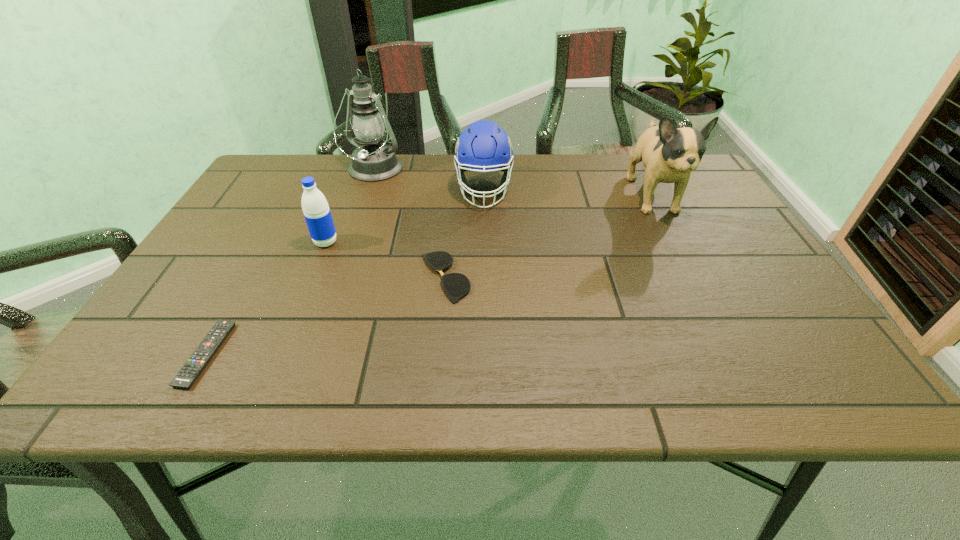
Locate an element on the screen. Image resolution: width=960 pixels, height=540 pixels. object that is positioned at the near left corner is located at coordinates (187, 375).

The image size is (960, 540). Identify the location of object at the far right corner. (669, 154).

The image size is (960, 540). What are the coordinates of `vacant space at the far edge of the desktop` in the screenshot? It's located at (334, 170).

This screenshot has width=960, height=540. In the image, there is a desktop. Find the location of `vacant space at the near edge`. vacant space at the near edge is located at coordinates (389, 381).

In the image, there is a desktop. Where is `blank space at the left edge`? blank space at the left edge is located at coordinates (266, 210).

I want to click on vacant space at the right edge, so click(739, 234).

Where is `vacant space at the far left corner`? vacant space at the far left corner is located at coordinates (296, 171).

The width and height of the screenshot is (960, 540). What are the coordinates of `vacant area at the near left corner` in the screenshot? It's located at (170, 370).

The height and width of the screenshot is (540, 960). In order to click on unoccupied area between the football helmet and the spectacles in this screenshot , I will do `click(465, 234)`.

This screenshot has height=540, width=960. I want to click on free spot between the fourth farthest object and the fifth tallest object, so click(385, 260).